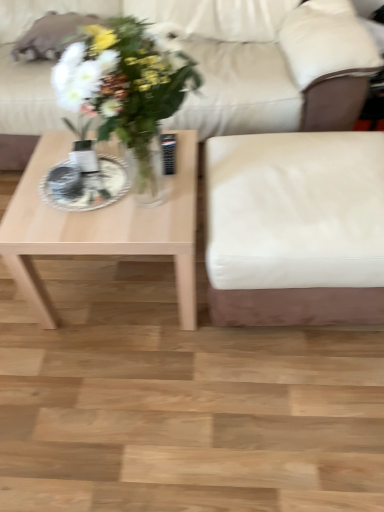
In order to click on blank space situated above white glossy plate at center (from a real-world perspective) in this screenshot , I will do `click(80, 173)`.